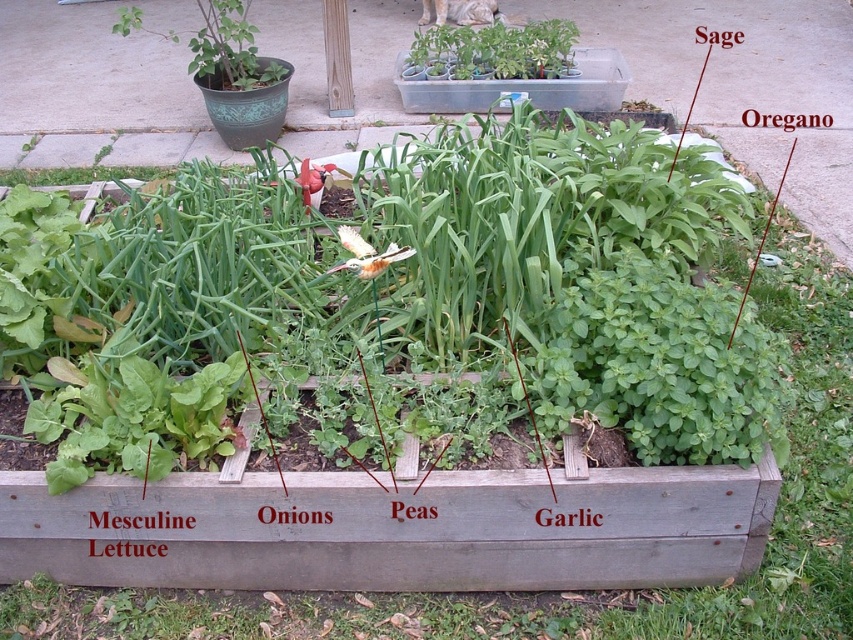
Question: Among these objects, which one is farthest from the camera?

Choices:
 (A) green glazed pot at upper left
 (B) clear plastic tray at upper center
 (C) white matte flower at center

Answer: (C)

Question: Considering the relative positions of green glazed pot at upper left and translucent white butterfly at center in the image provided, where is green glazed pot at upper left located with respect to translucent white butterfly at center?

Choices:
 (A) right
 (B) left

Answer: (B)

Question: Does translucent white butterfly at center appear under white matte flower at center?

Choices:
 (A) no
 (B) yes

Answer: (B)

Question: Does clear plastic tray at upper center lie in front of green glazed pot at upper left?

Choices:
 (A) yes
 (B) no

Answer: (B)

Question: Which object appears farthest from the camera in this image?

Choices:
 (A) translucent white butterfly at center
 (B) green glazed pot at upper left
 (C) clear plastic tray at upper center

Answer: (C)

Question: Which point is farther from the camera taking this photo?

Choices:
 (A) 445,108
 (B) 357,269

Answer: (A)